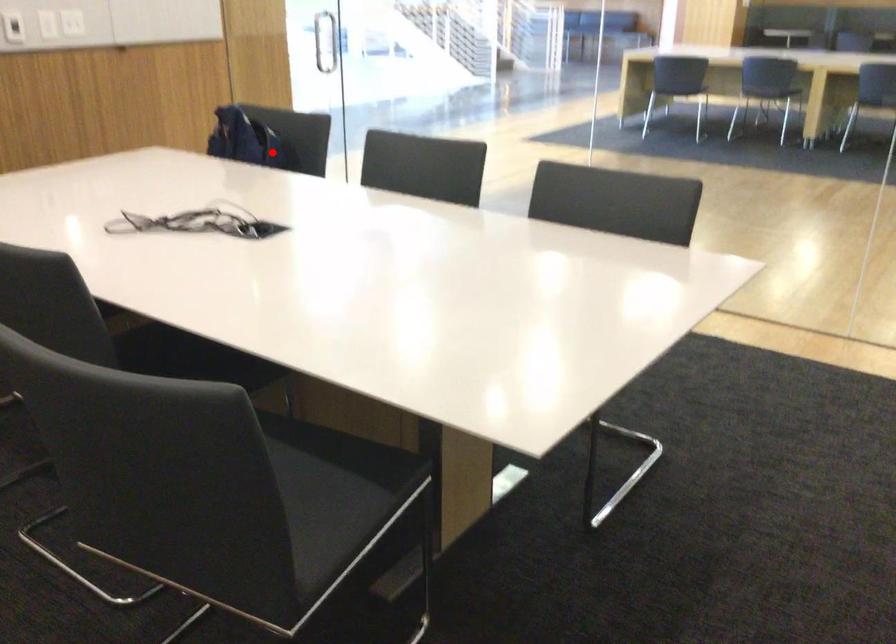
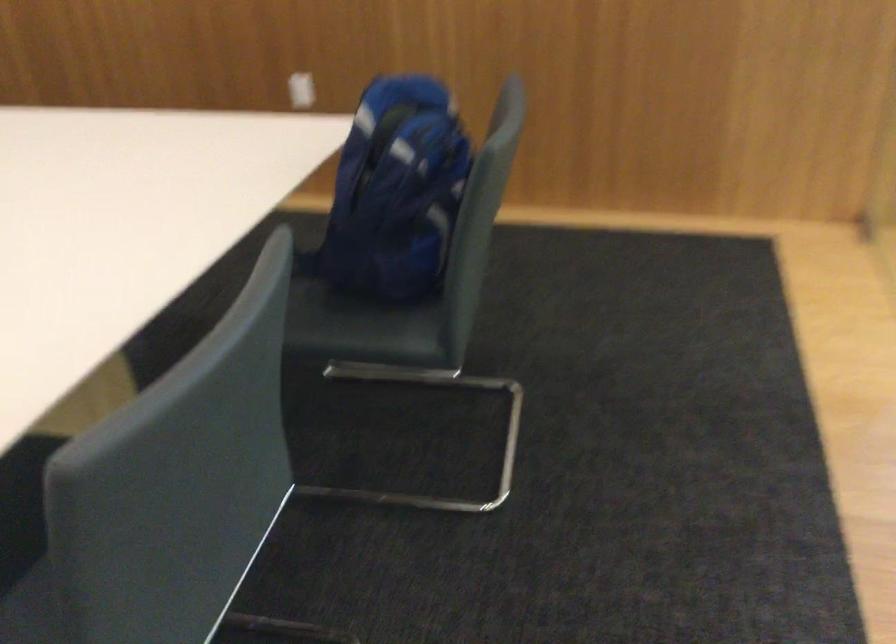
Question: A red point is marked in image1. In image2, is the corresponding 3D point closer to the camera or farther? Reply with the corresponding letter.

Choices:
 (A) The corresponding 3D point is closer.
 (B) The corresponding 3D point is farther.

Answer: (A)